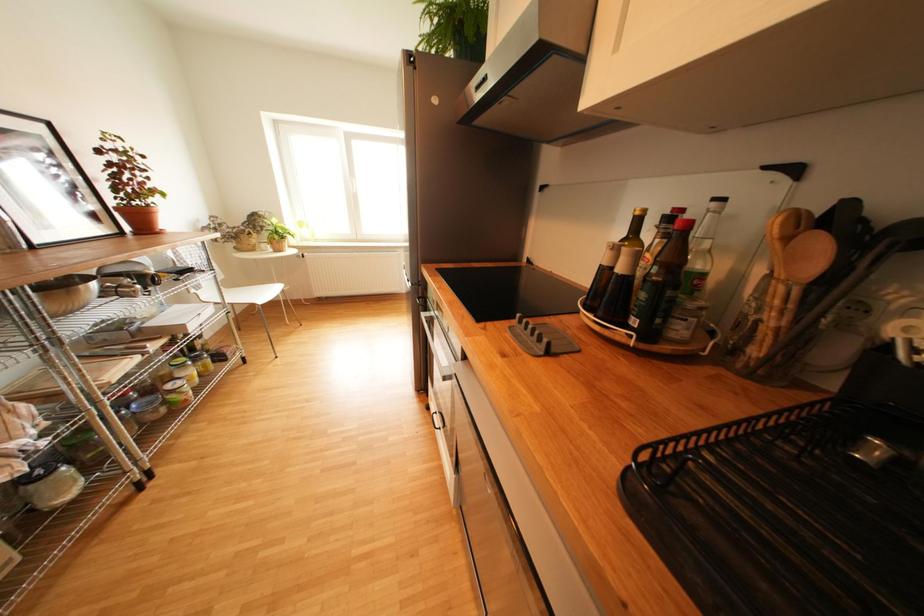
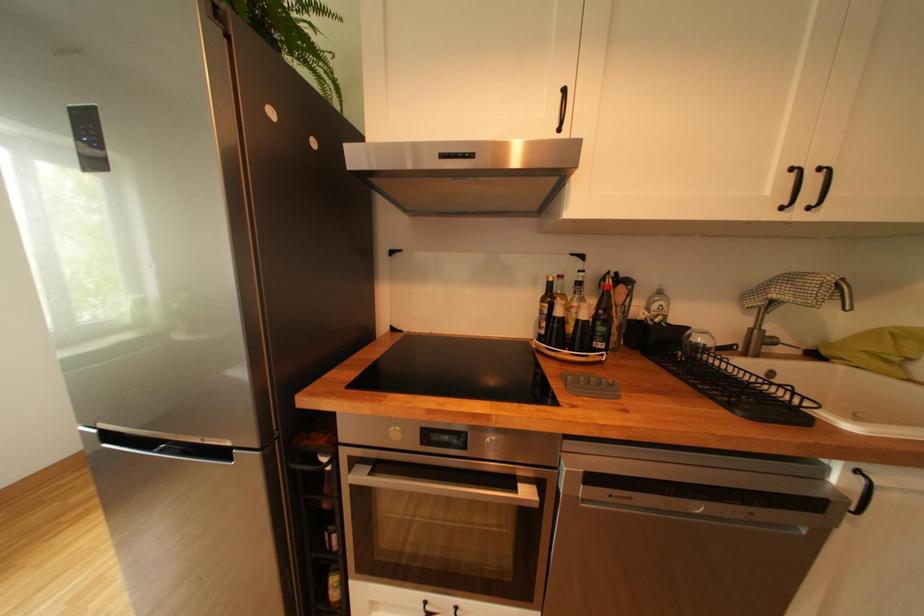
Question: The camera is either moving clockwise (left) or counter-clockwise (right) around the object. The first image is from the beginning of the video and the second image is from the end. Is the camera moving left or right when shooting the video?

Choices:
 (A) Left
 (B) Right

Answer: (A)